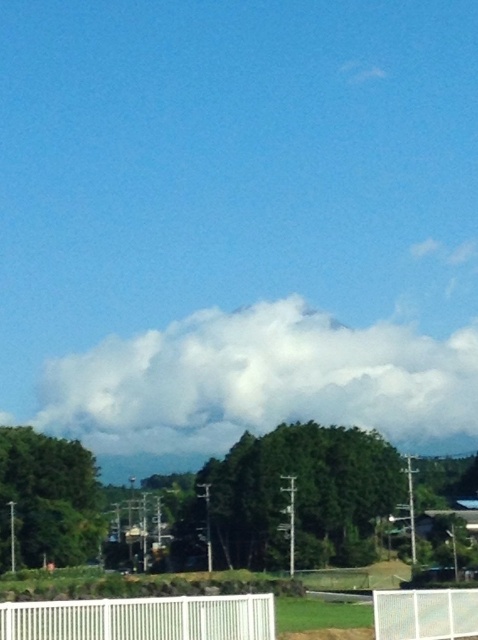
You are standing at the white metal fence in the foreground of the rural landscape. You notice two points marked in the scene. Which point is closer to you, point (130, 627) or point (426, 611)?

Point (130, 627) is in front of point (426, 611), so it is closer to you.

You are a landscape architect designing a new garden. You need to decide which fence to use between the white plastic fence at lower center and the white mesh fence at lower center. Based on their spatial presence in the image, which fence takes up more visual space and might be better for creating a subtle barrier?

The white mesh fence at lower center occupies more space than the white plastic fence at lower center, so it might be better for creating a subtle barrier since it is more visually present.